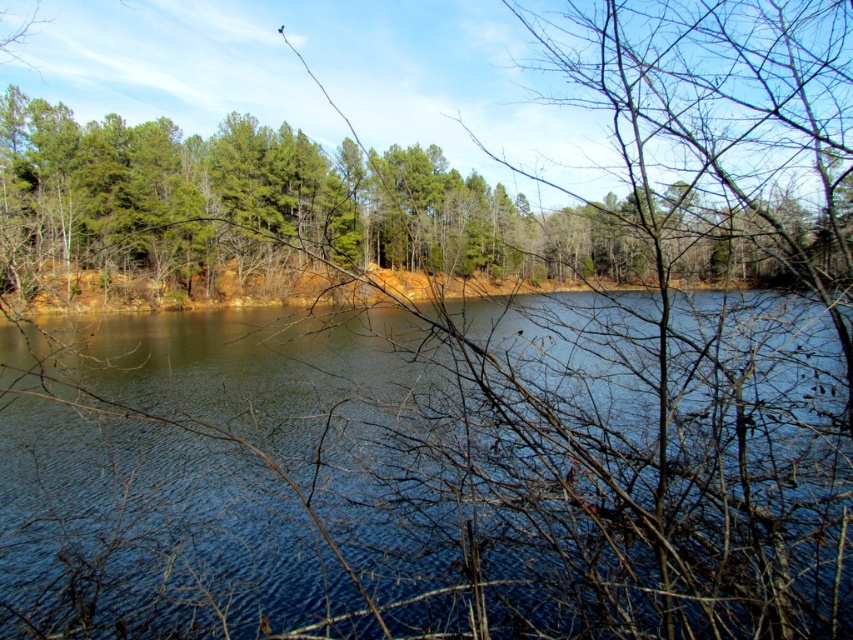
Question: Does blue water at center appear under green matte trees at center?

Choices:
 (A) yes
 (B) no

Answer: (A)

Question: Does blue water at center come in front of green matte trees at center?

Choices:
 (A) yes
 (B) no

Answer: (A)

Question: Which of the following is the closest to the observer?

Choices:
 (A) blue water at center
 (B) green matte trees at center

Answer: (A)

Question: Where is blue water at center located in relation to green matte trees at center in the image?

Choices:
 (A) right
 (B) left

Answer: (B)